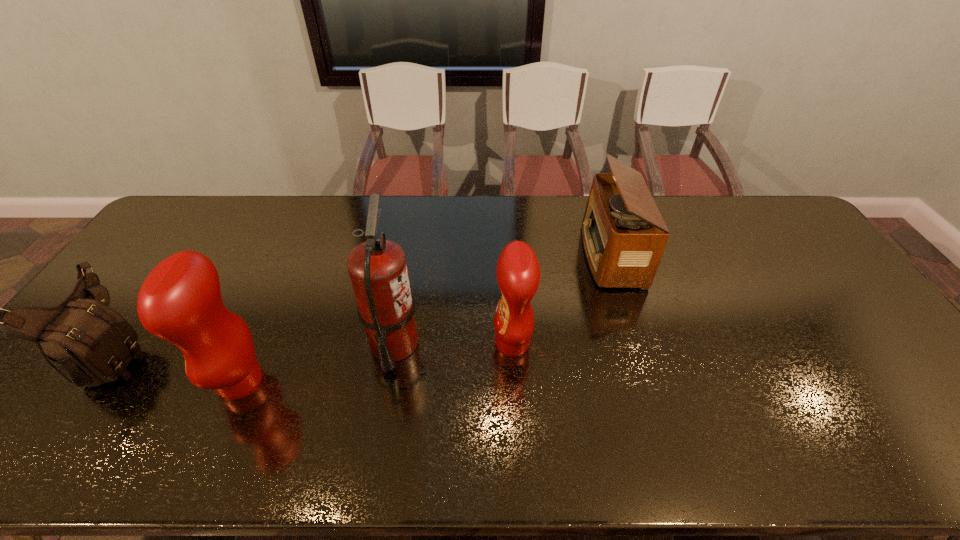
Given the evenly spaced condiments in the image, where should an extra condiment be added on the right to preserve the spacing? Please point to a vacant space. Please provide its 2D coordinates. Your answer should be formatted as a tuple, i.e. [(x, y)], where the tuple contains the x and y coordinates of a point satisfying the conditions above.

[(750, 310)]